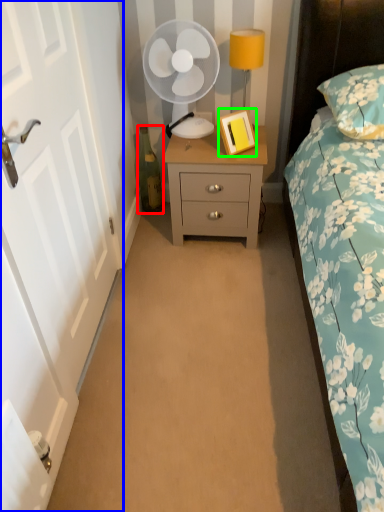
Question: Which is farther away from bottle (highlighted by a red box)? door (highlighted by a blue box) or picture frame (highlighted by a green box)?

Choices:
 (A) door
 (B) picture frame

Answer: (A)